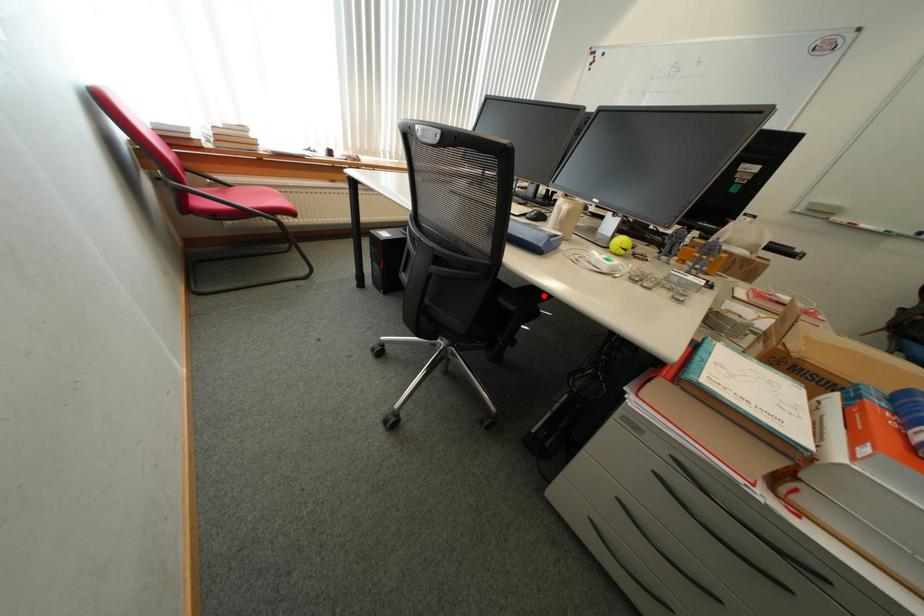
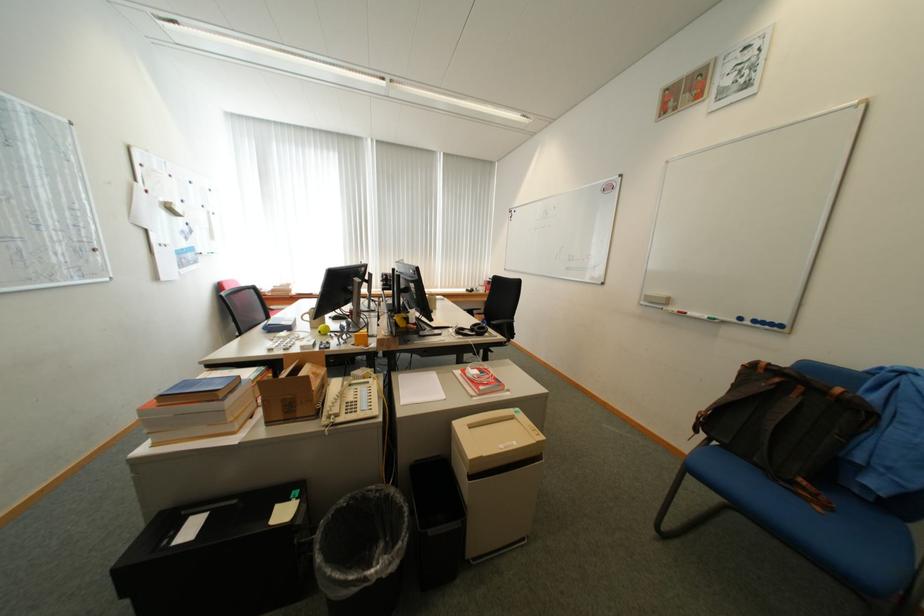
Question: I am providing you with two images of the same scene from different viewpoints. A red point is marked on the first image. Can you still see the location of the red point in image 2?

Choices:
 (A) Yes
 (B) No

Answer: (B)